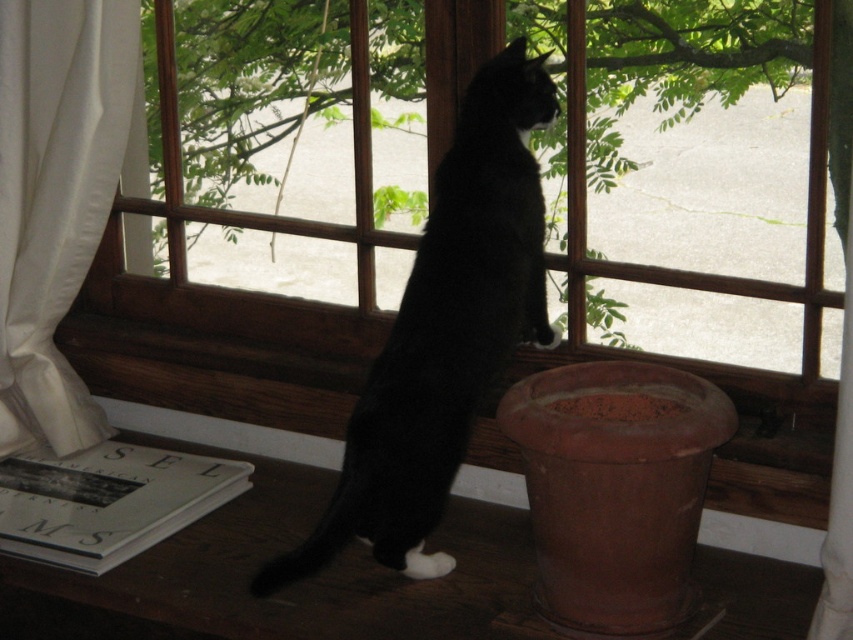
Question: Which point is farther from the camera taking this photo?

Choices:
 (A) tap(82, 140)
 (B) tap(793, 285)

Answer: (A)

Question: Can you confirm if matte brown pot at lower right is smaller than black fur cat at center?

Choices:
 (A) no
 (B) yes

Answer: (A)

Question: Is wooden frame at center smaller than matte brown pot at lower right?

Choices:
 (A) yes
 (B) no

Answer: (B)

Question: Is wooden frame at center above matte brown pot at lower right?

Choices:
 (A) no
 (B) yes

Answer: (B)

Question: Which of the following is the closest to the observer?

Choices:
 (A) wooden frame at center
 (B) black fur cat at center
 (C) white fabric curtain at left

Answer: (B)

Question: Which of the following is the closest to the observer?

Choices:
 (A) (77, 112)
 (B) (496, 214)
 (C) (126, 438)

Answer: (B)